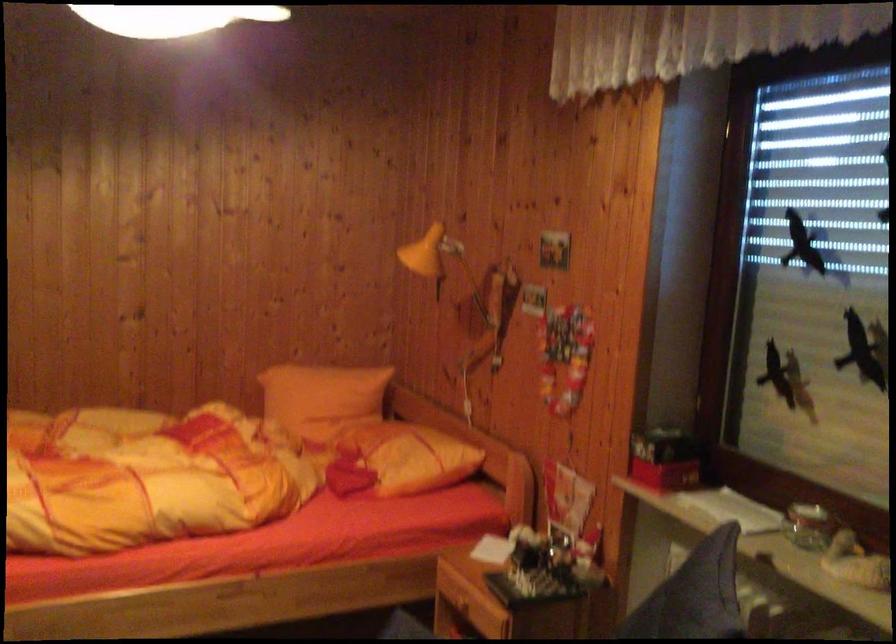
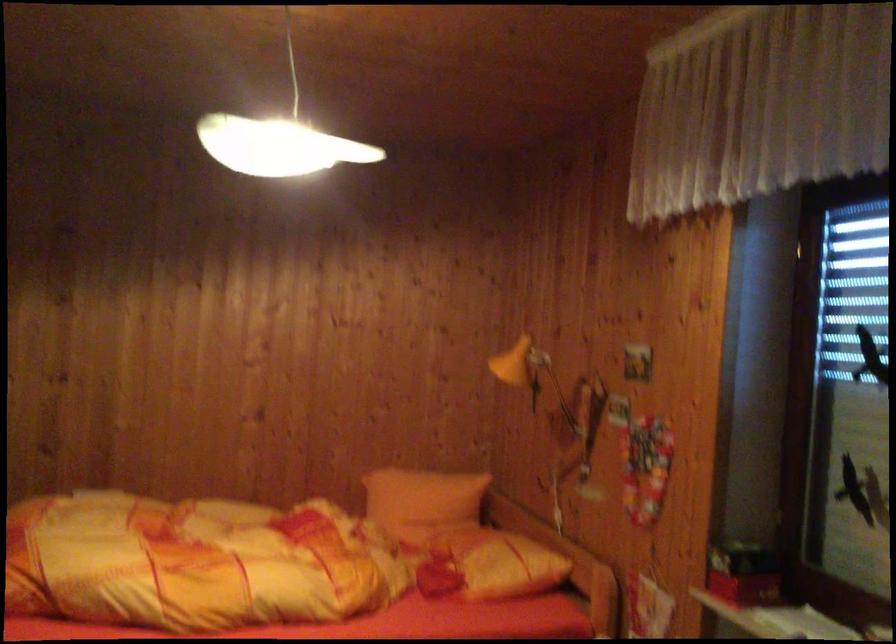
Question: The camera is either moving clockwise (left) or counter-clockwise (right) around the object. The first image is from the beginning of the video and the second image is from the end. Is the camera moving left or right when shooting the video?

Choices:
 (A) Left
 (B) Right

Answer: (B)